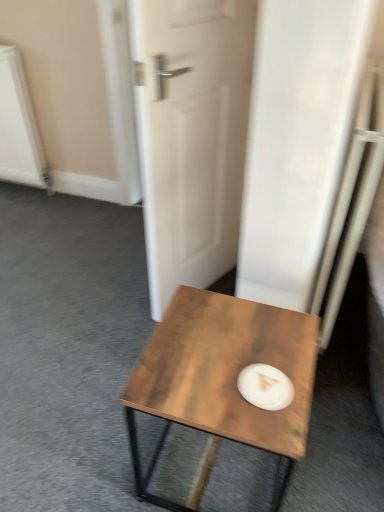
Question: Is white matte paper plate at center taller than wooden coffee table at center?

Choices:
 (A) no
 (B) yes

Answer: (A)

Question: From the image's perspective, is white matte paper plate at center located beneath wooden coffee table at center?

Choices:
 (A) no
 (B) yes

Answer: (A)

Question: Does white matte paper plate at center appear on the left side of wooden coffee table at center?

Choices:
 (A) yes
 (B) no

Answer: (B)

Question: From a real-world perspective, is white matte paper plate at center under wooden coffee table at center?

Choices:
 (A) yes
 (B) no

Answer: (B)

Question: Is white matte paper plate at center positioned beyond the bounds of wooden coffee table at center?

Choices:
 (A) no
 (B) yes

Answer: (A)

Question: Considering the relative sizes of white matte paper plate at center and wooden coffee table at center in the image provided, is white matte paper plate at center thinner than wooden coffee table at center?

Choices:
 (A) yes
 (B) no

Answer: (A)

Question: From a real-world perspective, is white matte door at center beneath wooden coffee table at center?

Choices:
 (A) no
 (B) yes

Answer: (A)

Question: Does white matte door at center have a lesser height compared to wooden coffee table at center?

Choices:
 (A) yes
 (B) no

Answer: (B)

Question: From the image's perspective, is white matte door at center beneath wooden coffee table at center?

Choices:
 (A) no
 (B) yes

Answer: (A)

Question: Does white matte door at center appear on the left side of wooden coffee table at center?

Choices:
 (A) no
 (B) yes

Answer: (B)

Question: Can you confirm if white matte door at center is smaller than wooden coffee table at center?

Choices:
 (A) no
 (B) yes

Answer: (A)

Question: Can you confirm if white matte door at center is thinner than wooden coffee table at center?

Choices:
 (A) no
 (B) yes

Answer: (B)

Question: Is wooden coffee table at center at the right side of white matte paper plate at center?

Choices:
 (A) yes
 (B) no

Answer: (B)